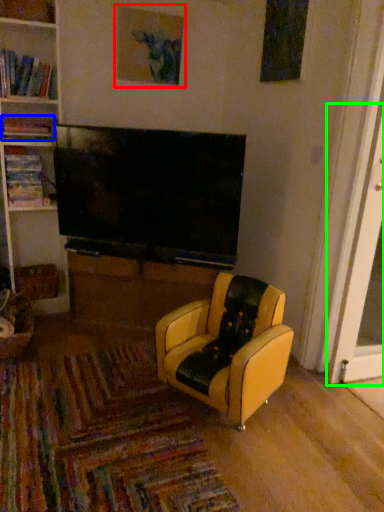
Question: Considering the real-world distances, which object is closest to picture frame (highlighted by a red box)? book (highlighted by a blue box) or screen door (highlighted by a green box).

Choices:
 (A) book
 (B) screen door

Answer: (A)